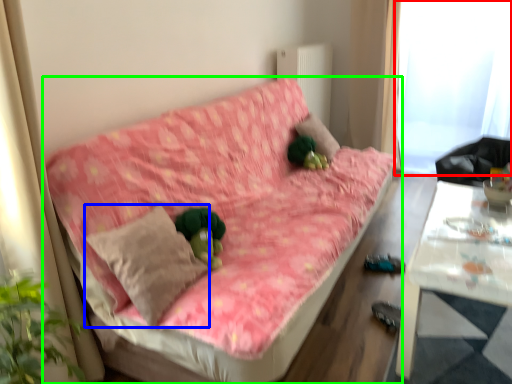
Question: Based on their relative distances, which object is farther from window screen (highlighted by a red box)? Choose from throw pillow (highlighted by a blue box) and studio couch (highlighted by a green box).

Choices:
 (A) throw pillow
 (B) studio couch

Answer: (A)